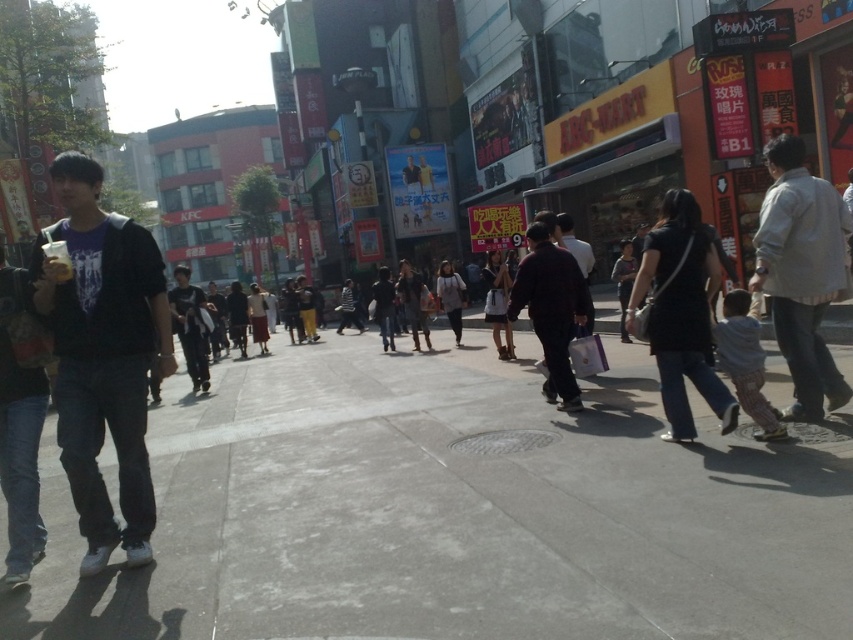
You are standing at the edge of the gray concrete pavement at center and want to reach a bus stop located 3 meters away from your current position. Can you safely walk across the pavement without needing to step off it?

The gray concrete pavement at center and viewer are 2.69 meters apart. Since the bus stop is 3 meters away, you would need to walk beyond the current distance of the pavement, requiring you to step off it to reach the bus stop.

You are a photographer standing on the bustling urban street scene. You want to take a photo of the light beige shirt at right and the dark gray hoodie at center. Which one should you focus on first to ensure both are in clear focus?

The light beige shirt at right is closer to the viewer than the dark gray hoodie at center. To ensure both are in clear focus, you should focus on the light beige shirt at right first, as it is closer, and the dark gray hoodie at center will fall within the depth of field if the focus is set properly.

You are a delivery person trying to navigate through the crowd on the gray concrete pavement at center and the dark gray hoodie at center. Which object is on the left side of the other?

The dark gray hoodie at center is on the left side of the gray concrete pavement at center because the gray concrete pavement at center is positioned on the right side of dark gray hoodie at center.